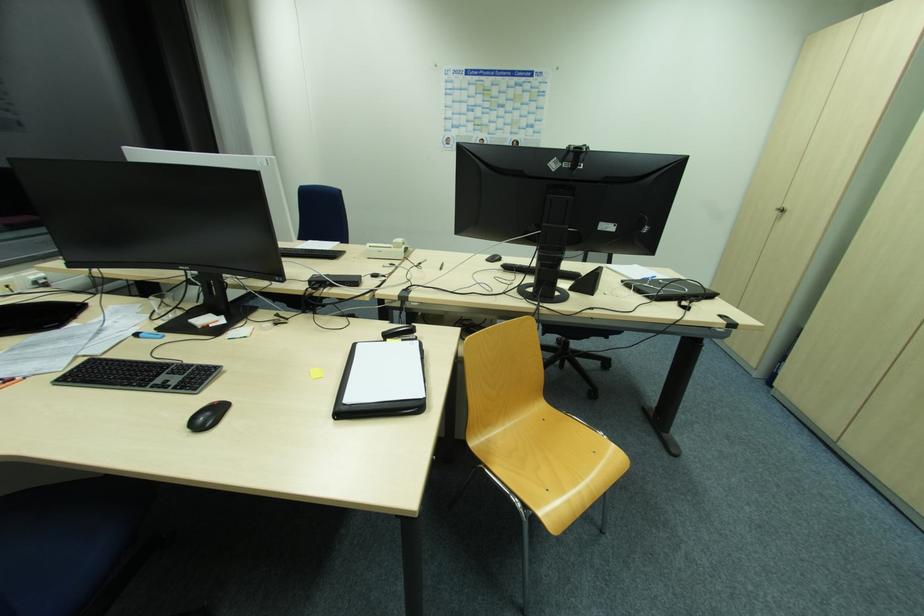
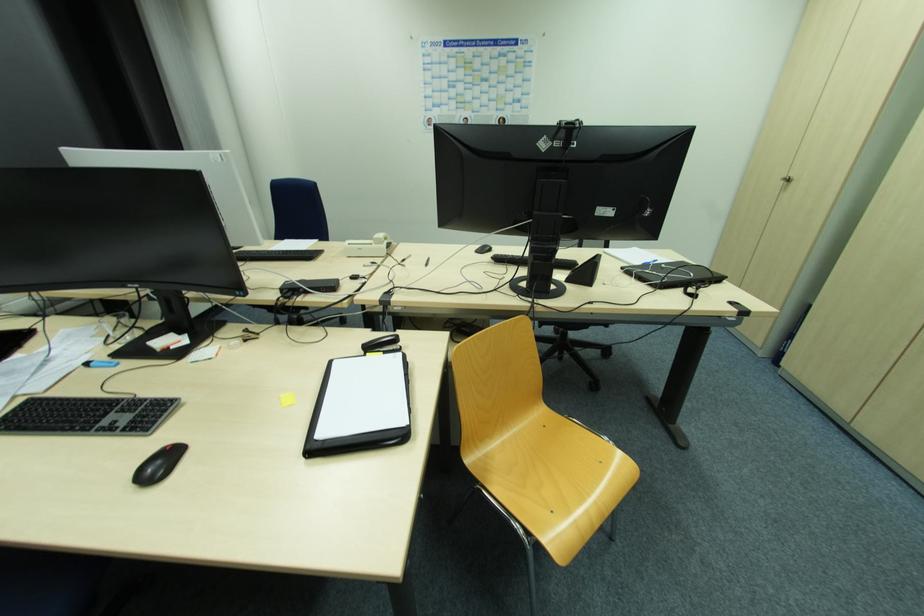
Locate, in the second image, the point that corresponds to (x=415, y=331) in the first image.

(397, 341)